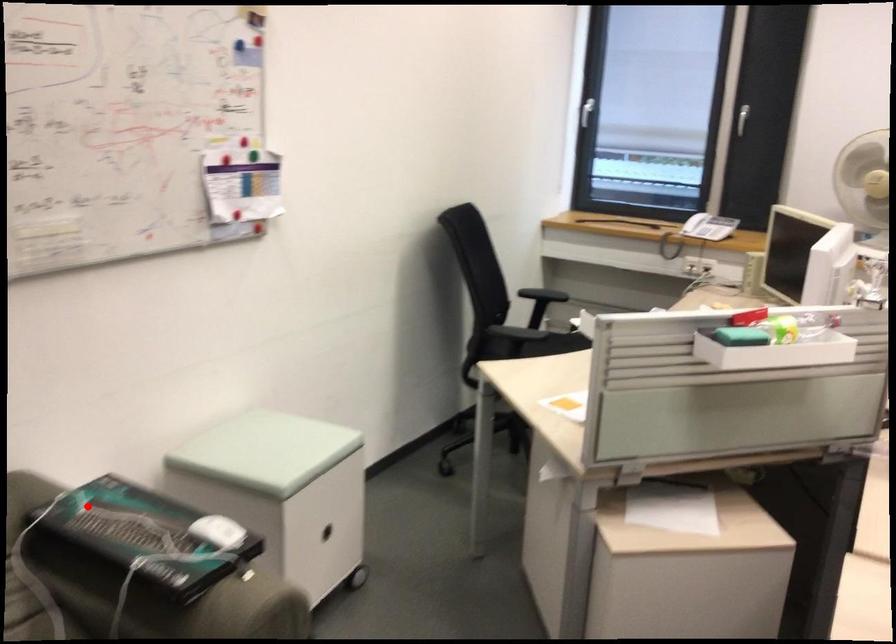
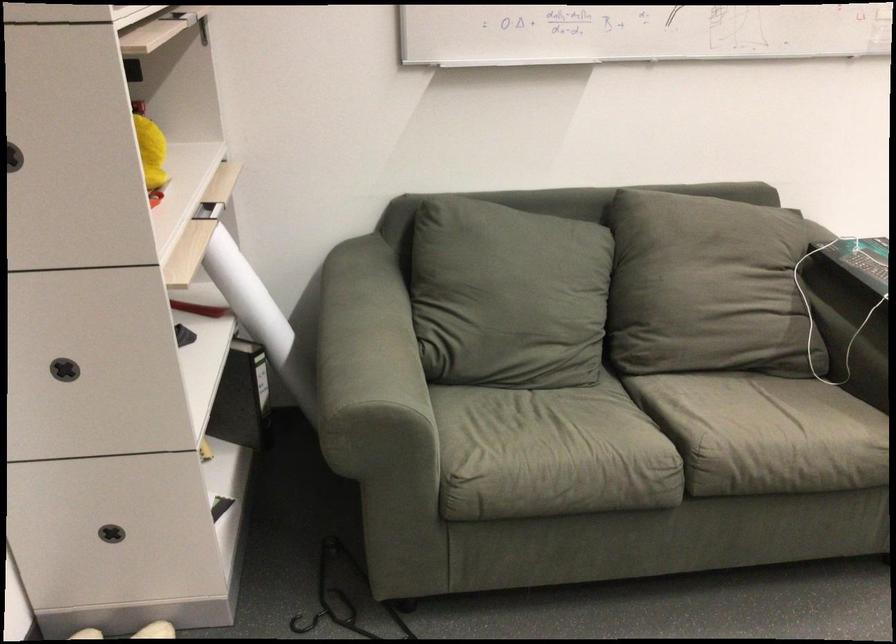
Question: A red point is marked in image1. In image2, is the corresponding 3D point closer to the camera or farther? Reply with the corresponding letter.

Choices:
 (A) The corresponding 3D point is closer.
 (B) The corresponding 3D point is farther.

Answer: (B)